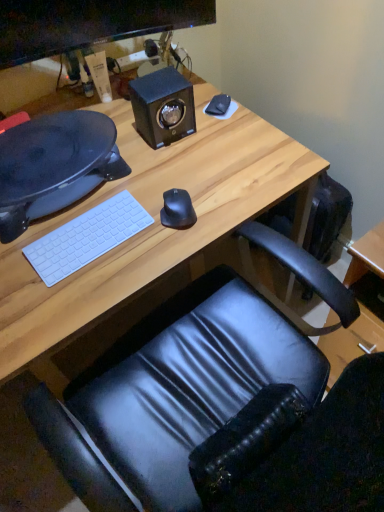
Where is `vacant space to the left of black matte notepad at upper right`? The width and height of the screenshot is (384, 512). vacant space to the left of black matte notepad at upper right is located at coordinates (173, 136).